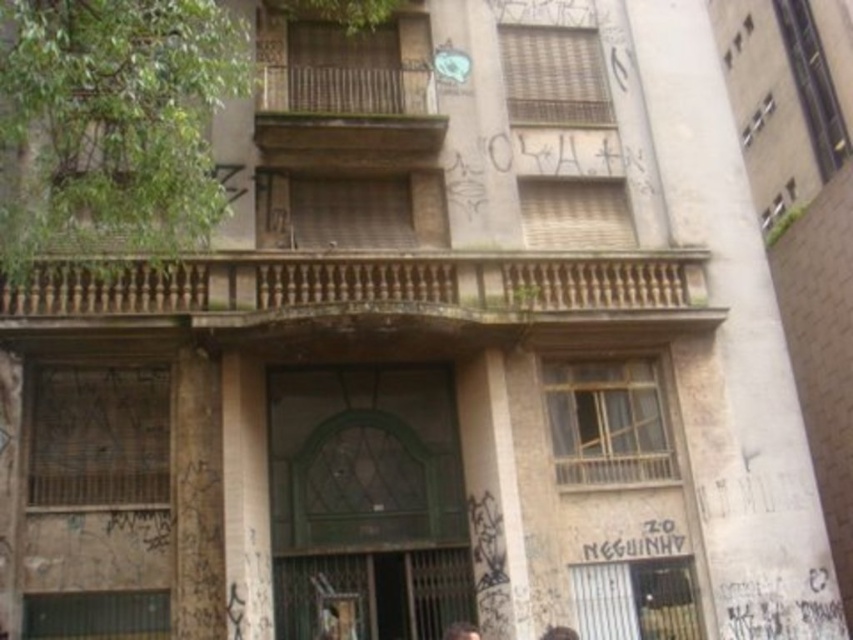
Is point (210, 381) less distant than point (250, 605)?

That is False.

Based on the photo, does rusty concrete pillar at center have a lesser width compared to brown wood pillar at center?

In fact, rusty concrete pillar at center might be wider than brown wood pillar at center.

Is point (202, 449) farther from camera compared to point (262, 429)?

No.

Where is `rusty concrete pillar at center`? The width and height of the screenshot is (853, 640). rusty concrete pillar at center is located at coordinates (196, 497).

Is point (791, 384) positioned behind point (194, 602)?

That is True.

Can you confirm if smooth concrete pillar at right is positioned to the right of rusty concrete pillar at center?

Yes, smooth concrete pillar at right is to the right of rusty concrete pillar at center.

This screenshot has width=853, height=640. Identify the location of smooth concrete pillar at right. (737, 346).

This screenshot has width=853, height=640. In order to click on smooth concrete pillar at right in this screenshot , I will do `click(737, 346)`.

Between smooth concrete pillar at right and dark brown hair at lower center, which one is positioned lower?

dark brown hair at lower center is lower down.

Is smooth concrete pillar at right thinner than dark brown hair at lower center?

No.

Describe the element at coordinates (737, 346) in the screenshot. The image size is (853, 640). I see `smooth concrete pillar at right` at that location.

At what (x,y) coordinates should I click in order to perform the action: click on smooth concrete pillar at right. Please return your answer as a coordinate pair (x, y). The image size is (853, 640). Looking at the image, I should click on (737, 346).